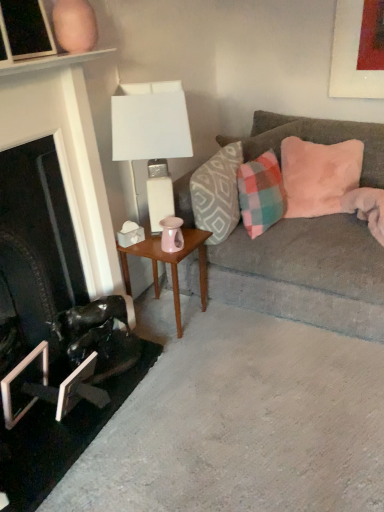
Question: Considering the relative sizes of pink plush pillow at upper right, the first pillow positioned from the right, and plaid fabric pillow at right, the 2th pillow positioned from the left, in the image provided, is pink plush pillow at upper right, the first pillow positioned from the right, bigger than plaid fabric pillow at right, the 2th pillow positioned from the left,?

Choices:
 (A) yes
 (B) no

Answer: (A)

Question: Does pink plush pillow at upper right, the first pillow positioned from the right, turn towards plaid fabric pillow at right, the 2th pillow positioned from the left?

Choices:
 (A) yes
 (B) no

Answer: (B)

Question: From the image's perspective, is pink plush pillow at upper right, arranged as the third pillow when viewed from the left, above plaid fabric pillow at right, the 2th pillow when ordered from right to left?

Choices:
 (A) no
 (B) yes

Answer: (B)

Question: Is pink plush pillow at upper right, the first pillow positioned from the right, in contact with plaid fabric pillow at right, the 2th pillow when ordered from right to left?

Choices:
 (A) no
 (B) yes

Answer: (A)

Question: Is the depth of pink plush pillow at upper right, arranged as the third pillow when viewed from the left, less than that of plaid fabric pillow at right, the 2th pillow when ordered from right to left?

Choices:
 (A) yes
 (B) no

Answer: (B)

Question: Is pink plush pillow at upper right, the first pillow positioned from the right, further to the viewer compared to plaid fabric pillow at right, the 2th pillow positioned from the left?

Choices:
 (A) no
 (B) yes

Answer: (B)

Question: Can you confirm if plaid fabric pillow at right, the 2th pillow positioned from the left, is bigger than pink plush pillow at upper right, arranged as the third pillow when viewed from the left?

Choices:
 (A) no
 (B) yes

Answer: (A)

Question: Is plaid fabric pillow at right, the 2th pillow positioned from the left, taller than pink plush pillow at upper right, arranged as the third pillow when viewed from the left?

Choices:
 (A) no
 (B) yes

Answer: (A)

Question: Is there a large distance between plaid fabric pillow at right, the 2th pillow positioned from the left, and pink plush pillow at upper right, the first pillow positioned from the right?

Choices:
 (A) yes
 (B) no

Answer: (B)

Question: Considering the relative sizes of plaid fabric pillow at right, the 2th pillow positioned from the left, and pink plush pillow at upper right, the first pillow positioned from the right, in the image provided, is plaid fabric pillow at right, the 2th pillow positioned from the left, thinner than pink plush pillow at upper right, the first pillow positioned from the right,?

Choices:
 (A) yes
 (B) no

Answer: (B)

Question: Considering the relative positions of plaid fabric pillow at right, the 2th pillow positioned from the left, and pink plush pillow at upper right, the first pillow positioned from the right, in the image provided, is plaid fabric pillow at right, the 2th pillow positioned from the left, behind pink plush pillow at upper right, the first pillow positioned from the right,?

Choices:
 (A) no
 (B) yes

Answer: (A)

Question: Is pink plush pillow at upper right, arranged as the third pillow when viewed from the left, located within plaid fabric pillow at right, the 2th pillow positioned from the left?

Choices:
 (A) no
 (B) yes

Answer: (A)

Question: Can you confirm if velvet gray couch at right is positioned to the left of metallic silver picture frame at lower left, which is the 2th picture frame in bottom-to-top order?

Choices:
 (A) yes
 (B) no

Answer: (B)